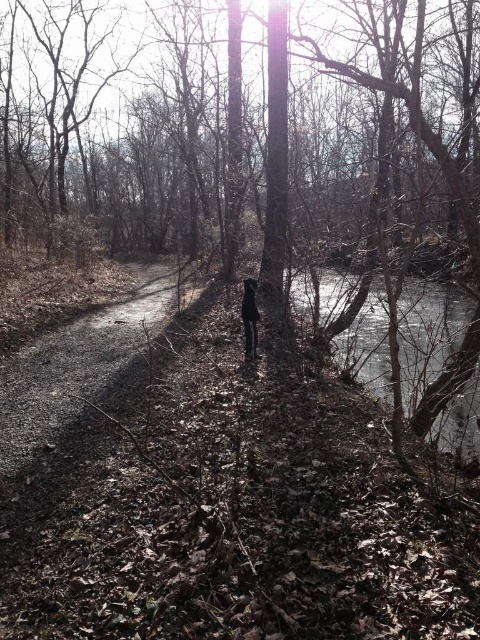
Which is behind, point (453, 291) or point (252, 346)?

Positioned behind is point (453, 291).

Does point (324, 321) come closer to viewer compared to point (253, 323)?

No, it is not.

This screenshot has height=640, width=480. I want to click on clear water at right, so click(428, 333).